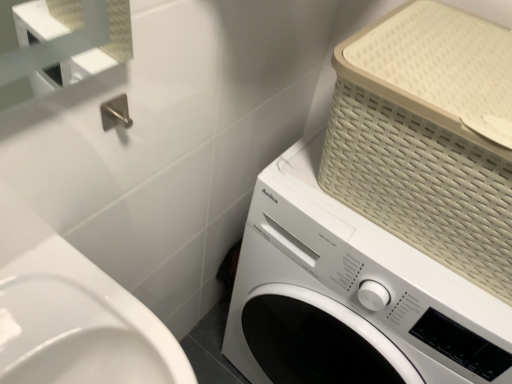
Question: Is point (327, 182) positioned closer to the camera than point (351, 337)?

Choices:
 (A) farther
 (B) closer

Answer: (B)

Question: From the image's perspective, is beige woven basket at upper right located above or below white matte washing machine at center?

Choices:
 (A) below
 (B) above

Answer: (B)

Question: Would you say beige woven basket at upper right is to the left or to the right of white matte washing machine at center in the picture?

Choices:
 (A) right
 (B) left

Answer: (A)

Question: Is white matte washing machine at center wider or thinner than beige woven basket at upper right?

Choices:
 (A) thin
 (B) wide

Answer: (B)

Question: Would you say white matte washing machine at center is to the left or to the right of beige woven basket at upper right in the picture?

Choices:
 (A) left
 (B) right

Answer: (A)

Question: Considering their positions, is white matte washing machine at center located in front of or behind beige woven basket at upper right?

Choices:
 (A) front
 (B) behind

Answer: (B)

Question: Considering the positions of point [x=303, y=183] and point [x=437, y=167], is point [x=303, y=183] closer or farther from the camera than point [x=437, y=167]?

Choices:
 (A) farther
 (B) closer

Answer: (A)